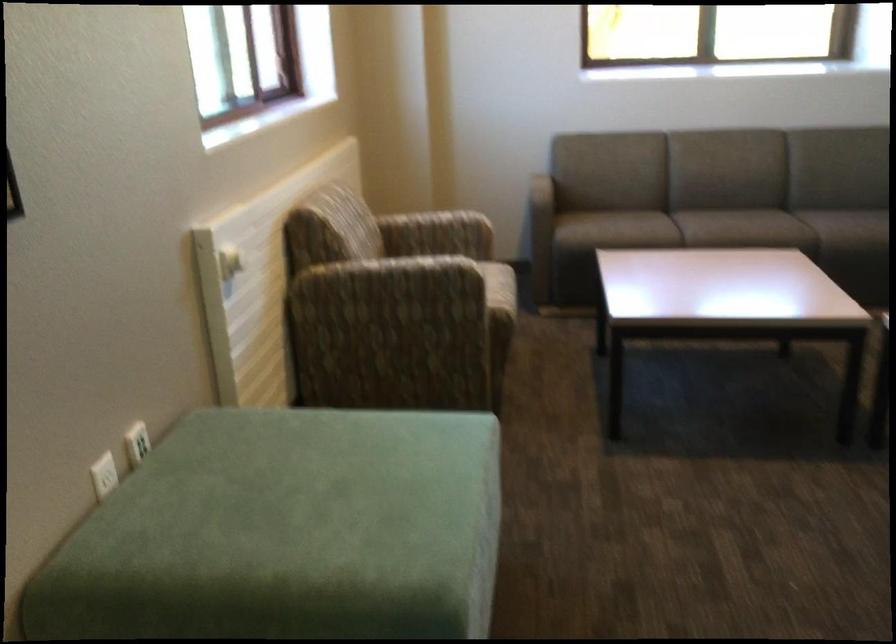
I want to click on patterned chair sitting surface, so click(x=458, y=254).